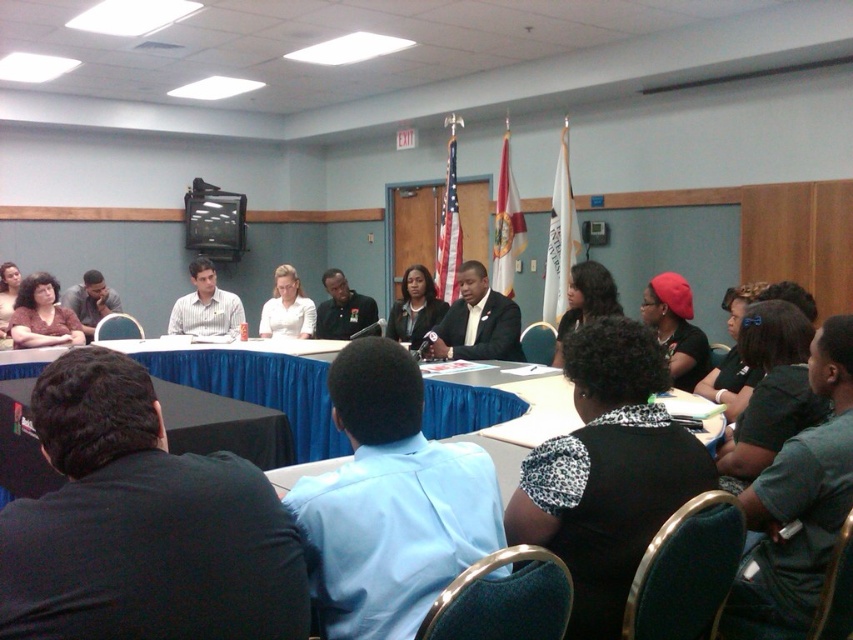
Question: Can you confirm if black fabric shirt at lower right is wider than matte black shirt at upper left?

Choices:
 (A) no
 (B) yes

Answer: (A)

Question: Is dark brown hair at center to the right of matte black shirt at upper left from the viewer's perspective?

Choices:
 (A) yes
 (B) no

Answer: (A)

Question: Which point is farther from the camera taking this photo?

Choices:
 (A) [606, 276]
 (B) [642, 339]
 (C) [741, 284]
 (D) [706, 362]

Answer: (C)

Question: Which of the following is the farthest from the observer?

Choices:
 (A) (405, 296)
 (B) (788, 412)

Answer: (A)

Question: Is matte black shirt at center smaller than matte black shirt at upper left?

Choices:
 (A) no
 (B) yes

Answer: (B)

Question: Considering the real-world distances, which object is closest to the matte red beanie at center?

Choices:
 (A) black fabric shirt at lower right
 (B) white glossy shirt at center
 (C) matte black blazer at center

Answer: (A)